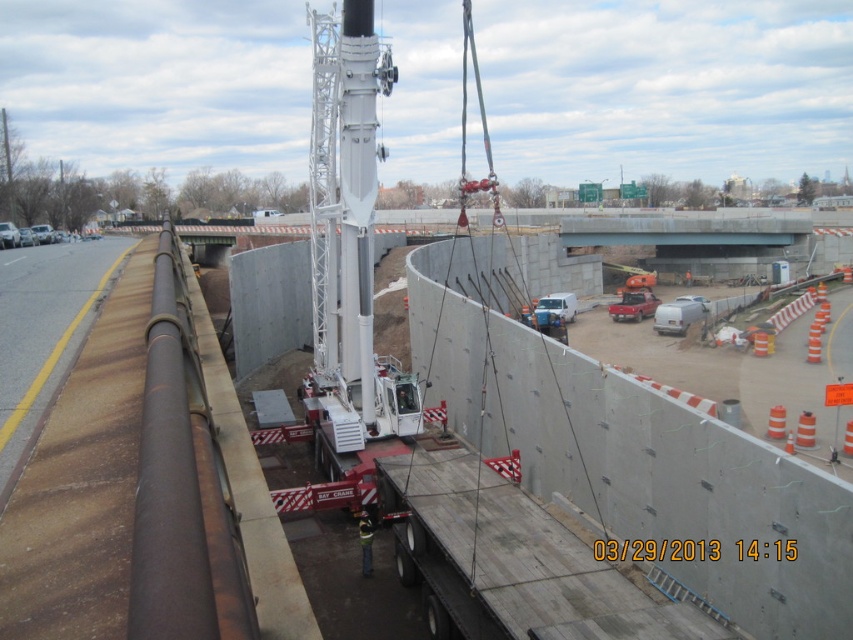
Question: Does concrete wall at center have a larger size compared to reflective yellow safety vest at center?

Choices:
 (A) yes
 (B) no

Answer: (A)

Question: Which of these objects is positioned closest to the brown asphalt highway at left?

Choices:
 (A) concrete wall at center
 (B) reflective yellow safety vest at center

Answer: (A)

Question: Can you confirm if concrete wall at center is wider than reflective yellow safety vest at center?

Choices:
 (A) no
 (B) yes

Answer: (B)

Question: Does concrete wall at center appear under reflective yellow safety vest at center?

Choices:
 (A) yes
 (B) no

Answer: (B)

Question: Which point is closer to the camera?

Choices:
 (A) reflective yellow safety vest at center
 (B) concrete wall at center

Answer: (B)

Question: Which object is positioned farthest from the concrete wall at center?

Choices:
 (A) reflective yellow safety vest at center
 (B) brown asphalt highway at left

Answer: (B)